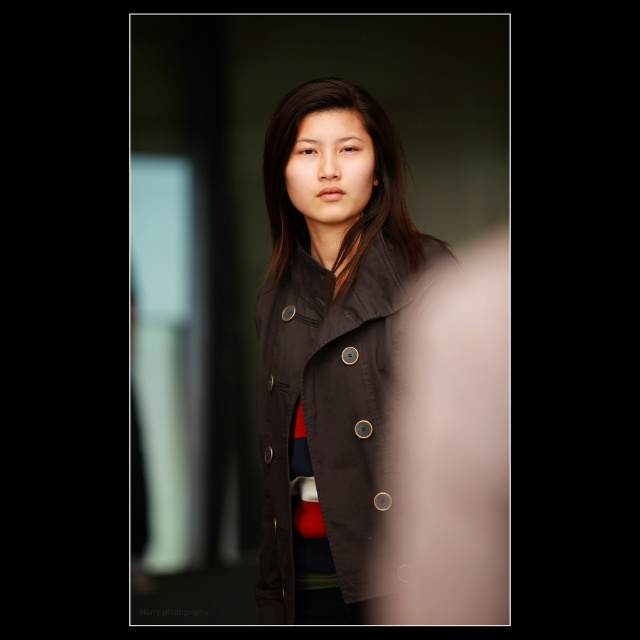
You are a fashion stylist trying to decide which coat to recommend for a client. The client wants to wear the matte brown jacket at center and the matte black coat at center together. Is it possible to layer these two items in a way that both are visible?

The matte brown jacket at center is below the matte black coat at center, so if you layer the matte black coat at center over the matte brown jacket at center, the jacket will be visible underneath. Both items can be worn together with the matte black coat at center on top.

You are a fashion designer trying to decide which coat to feature in your upcoming collection. You have two options in front of you, the matte brown jacket at center and the matte black coat at center. Based on their sizes, which one would be better suited for a design that emphasizes a tall silhouette?

The matte brown jacket at center is much taller than the matte black coat at center, so it would be better suited for a design that emphasizes a tall silhouette.

You are a fashion designer trying to decide which coat to feature in your collection. You have two options in front of you, the matte brown jacket at center and the matte black coat at center. Based on their sizes, which one do you think would be more suitable for a design that requires a looser fit?

The matte brown jacket at center has a larger width than the matte black coat at center, making it more suitable for a design that requires a looser fit.